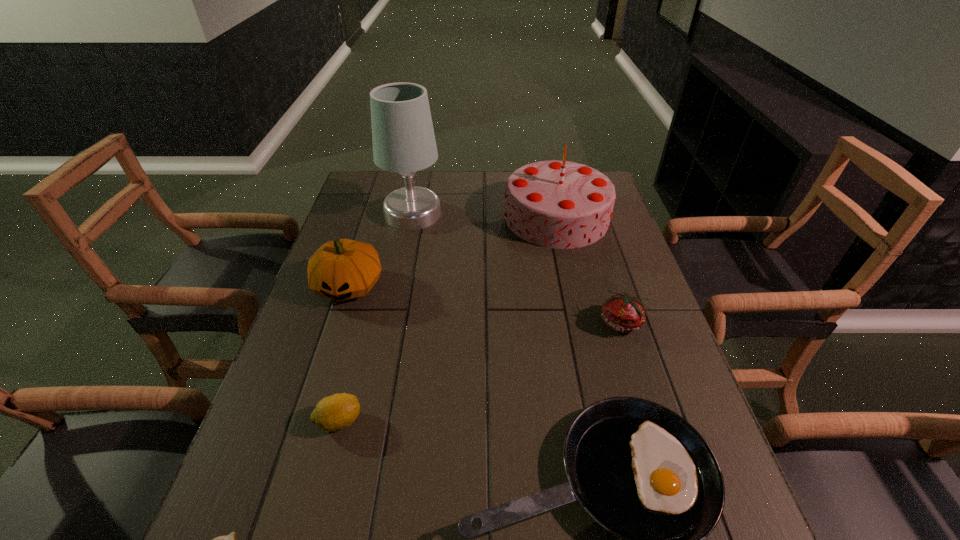
In order to click on the fifth closest object to the shorter lemon in this screenshot , I will do `click(403, 137)`.

Choose which object is the third nearest neighbor to the shortest object. Please provide its 2D coordinates. Your answer should be formatted as a tuple, i.e. [(x, y)], where the tuple contains the x and y coordinates of a point satisfying the conditions above.

[(342, 269)]

Locate an element on the screen. free space that satisfies the following two spatial constraints: 1. on the base of the birthday cake; 2. on the left side of the lampshade is located at coordinates (x=412, y=217).

Identify the location of vacant space that satisfies the following two spatial constraints: 1. on the side of the fourth tallest object with the carved face; 2. on the left side of the gourd. (337, 323).

Where is `vacant space that satisfies the following two spatial constraints: 1. on the base of the fourth tallest object; 2. on the left side of the tallest object`? vacant space that satisfies the following two spatial constraints: 1. on the base of the fourth tallest object; 2. on the left side of the tallest object is located at coordinates (391, 323).

Where is `vacant area in the image that satisfies the following two spatial constraints: 1. on the base of the tallest object; 2. on the left side of the tomato`? vacant area in the image that satisfies the following two spatial constraints: 1. on the base of the tallest object; 2. on the left side of the tomato is located at coordinates (391, 323).